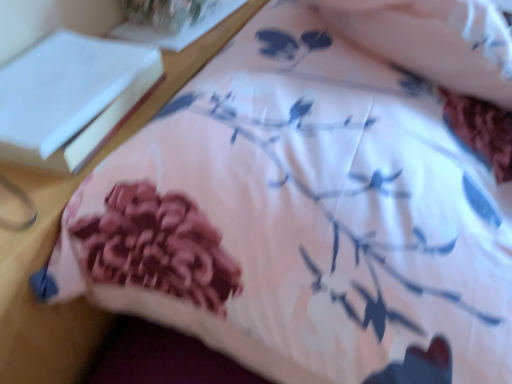
Question: Looking at the image, does white paper at upper left, the first book when ordered from front to back, seem bigger or smaller compared to white paper at upper left, acting as the 1th book starting from the back?

Choices:
 (A) small
 (B) big

Answer: (B)

Question: Looking at their shapes, would you say white paper at upper left, acting as the first book starting from the bottom, is wider or thinner than white paper at upper left, acting as the 1th book starting from the back?

Choices:
 (A) wide
 (B) thin

Answer: (A)

Question: Relative to white paper at upper left, acting as the 1th book starting from the back, is white paper at upper left, the 2th book positioned from the back, in front or behind?

Choices:
 (A) behind
 (B) front

Answer: (B)

Question: In terms of size, does white paper at upper left, acting as the 1th book starting from the back, appear bigger or smaller than white paper at upper left, acting as the first book starting from the bottom?

Choices:
 (A) big
 (B) small

Answer: (B)

Question: Considering the positions of white paper at upper left, acting as the 1th book starting from the back, and white paper at upper left, acting as the 2th book starting from the top, in the image, is white paper at upper left, acting as the 1th book starting from the back, taller or shorter than white paper at upper left, acting as the 2th book starting from the top,?

Choices:
 (A) tall
 (B) short

Answer: (B)

Question: Relative to white paper at upper left, the first book when ordered from front to back, is white paper at upper left, which is the 1th book in top-to-bottom order, in front or behind?

Choices:
 (A) behind
 (B) front

Answer: (A)

Question: From the image's perspective, is white paper at upper left, acting as the 1th book starting from the back, above or below white paper at upper left, the 2th book positioned from the back?

Choices:
 (A) above
 (B) below

Answer: (A)